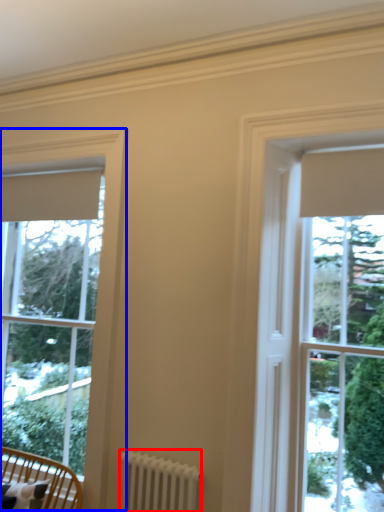
Question: Which of the following is the farthest to the observer, radiator (highlighted by a red box) or window (highlighted by a blue box)?

Choices:
 (A) radiator
 (B) window

Answer: (B)